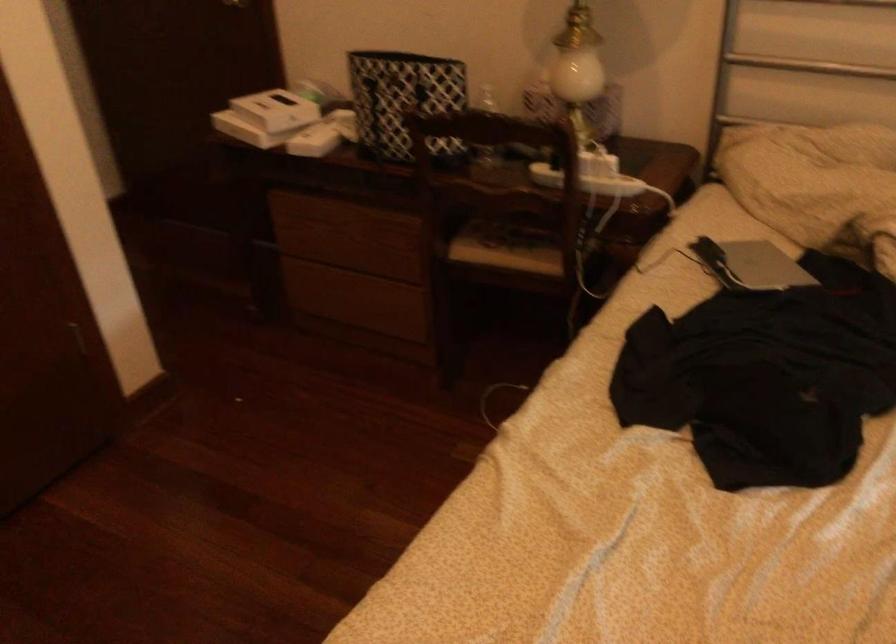
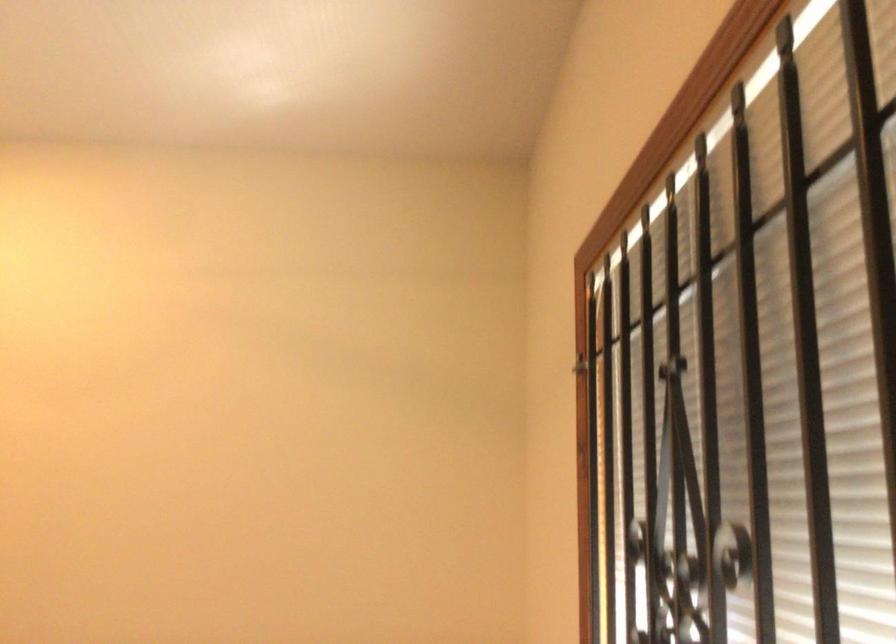
First-person continuous shooting, in which direction is the camera rotating?

The camera's rotation is toward right-up.